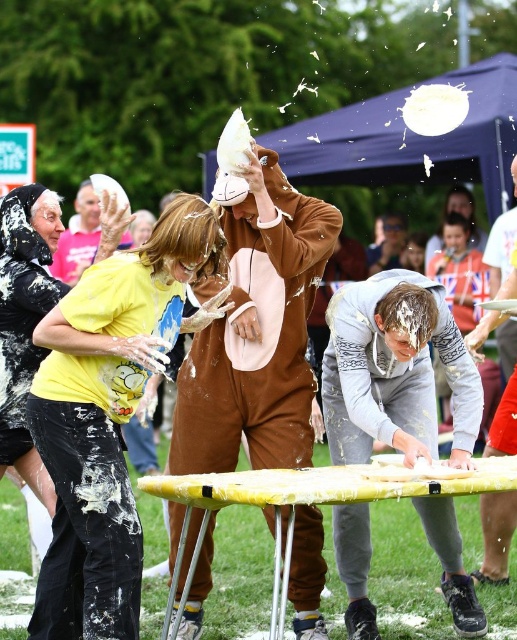
Between point (238, 365) and point (93, 221), which one is positioned behind?

The point (93, 221) is behind.

Does brown plush onesie at center lie behind yellow cotton shirt at upper left?

No, it is not.

Between point (185, 465) and point (58, 260), which one is positioned in front?

Point (185, 465)

The image size is (517, 640). I want to click on brown plush onesie at center, so click(x=257, y=333).

Which is below, brown plush onesie at center or white plastic plate at lower right?

brown plush onesie at center is below.

Does brown plush onesie at center have a smaller size compared to white plastic plate at lower right?

Actually, brown plush onesie at center might be larger than white plastic plate at lower right.

Does point (212, 392) lie in front of point (510, 381)?

Yes, point (212, 392) is in front of point (510, 381).

The image size is (517, 640). Find the location of `brown plush onesie at center`. brown plush onesie at center is located at coordinates (257, 333).

Can you confirm if yellow matte shirt at center is taller than brown plush onesie at center?

Incorrect, yellow matte shirt at center's height is not larger of brown plush onesie at center's.

Which is above, yellow matte shirt at center or brown plush onesie at center?

brown plush onesie at center

In order to click on yellow matte shirt at center in this screenshot , I will do `click(110, 416)`.

Image resolution: width=517 pixels, height=640 pixels. What are the coordinates of `yellow matte shirt at center` in the screenshot? It's located at (110, 416).